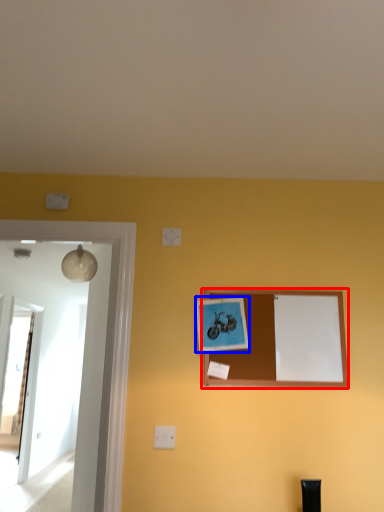
Question: Which object is further to the camera taking this photo, picture frame (highlighted by a red box) or picture frame (highlighted by a blue box)?

Choices:
 (A) picture frame
 (B) picture frame

Answer: (A)